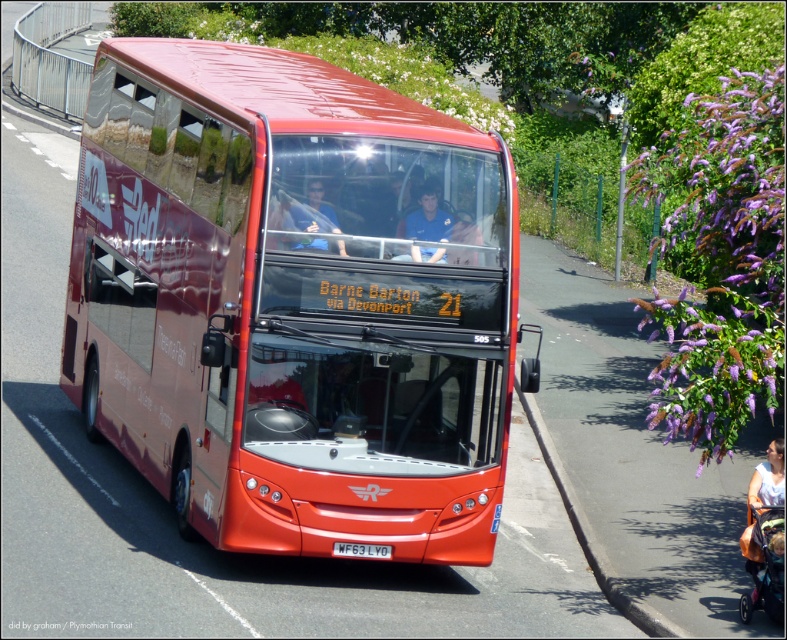
Question: Which point is farther to the camera?

Choices:
 (A) white plastic license plate at center
 (B) metallic red bus at center
 (C) white fabric person at lower right
 (D) matte black shirt at center

Answer: (C)

Question: Is metallic red bus at center to the right of blue fabric shirt at center from the viewer's perspective?

Choices:
 (A) yes
 (B) no

Answer: (A)

Question: Does metallic red bus at center lie in front of blue fabric shirt at center?

Choices:
 (A) yes
 (B) no

Answer: (B)

Question: Considering the real-world distances, which object is farthest from the white plastic license plate at center?

Choices:
 (A) matte black shirt at center
 (B) white fabric person at lower right
 (C) metallic red bus at center

Answer: (B)

Question: Among these objects, which one is nearest to the camera?

Choices:
 (A) white plastic license plate at center
 (B) metallic red bus at center

Answer: (B)

Question: Is blue fabric shirt at center positioned before white plastic license plate at center?

Choices:
 (A) no
 (B) yes

Answer: (B)